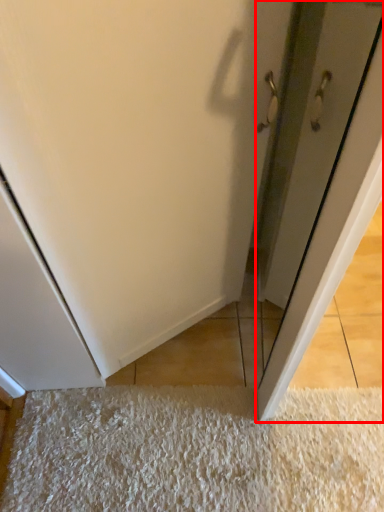
Question: Where is door (annotated by the red box) located in relation to mat in the image?

Choices:
 (A) right
 (B) left

Answer: (A)